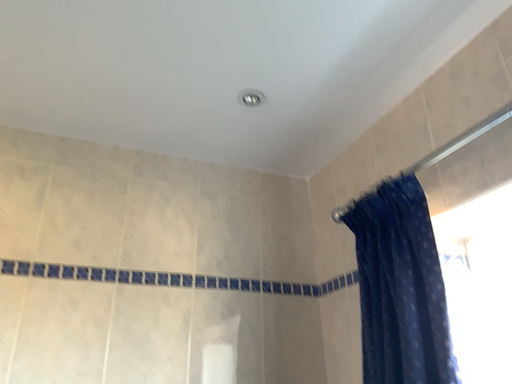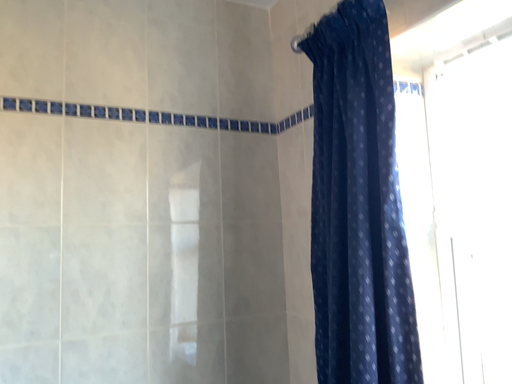
Question: How did the camera likely rotate when shooting the video?

Choices:
 (A) rotated downward
 (B) rotated upward

Answer: (A)